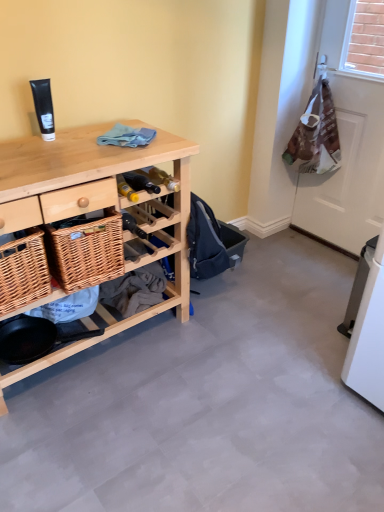
The width and height of the screenshot is (384, 512). Identify the location of vacant area to the right of natural wood desk at left. (240, 353).